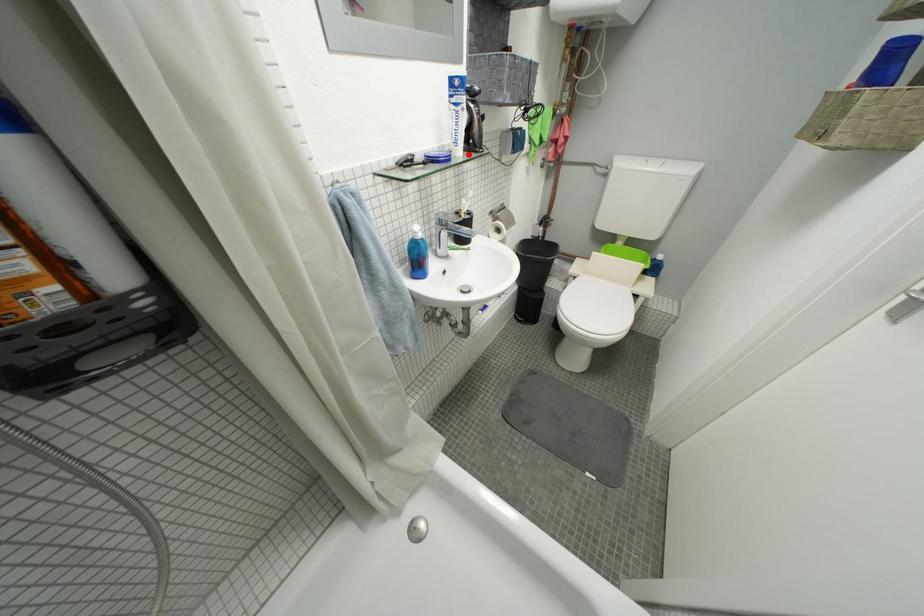
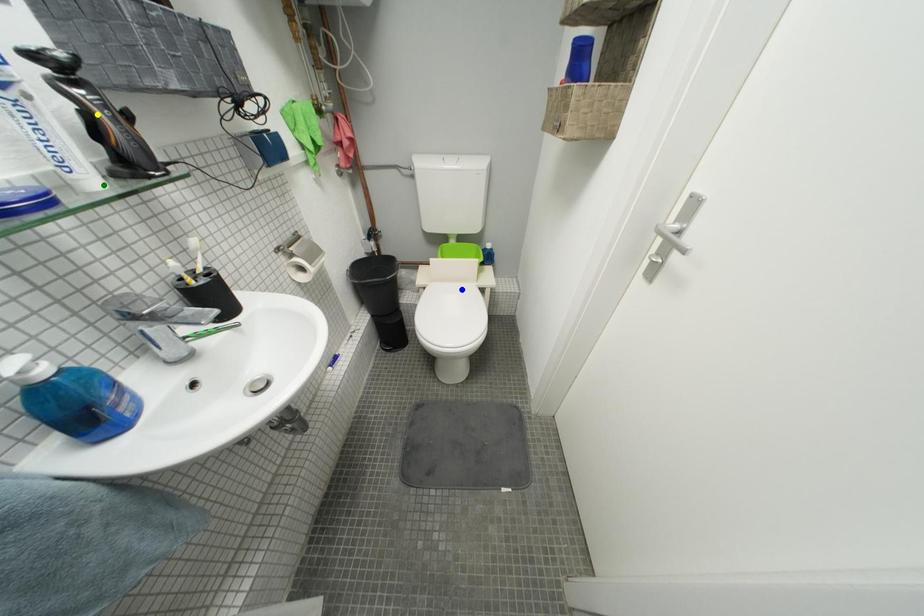
Question: I am providing you with two images of the same scene from different viewpoints. A red point is marked on the first image. You are given multiple points on the second image. In image 2, which mark is for the same physical point as the one in image 1?

Choices:
 (A) blue point
 (B) green point
 (C) yellow point

Answer: (B)